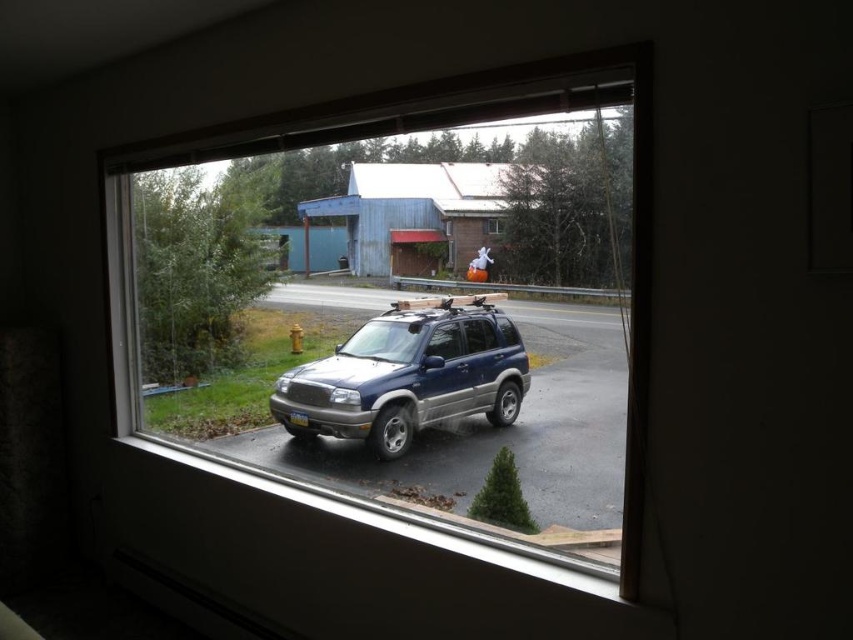
You are standing in a room with a clear glass window at center. If you want to look outside through the window, where should you position yourself relative to the window?

You should position yourself in front of the clear glass window at center to look outside through it.

You are an interior designer assessing the view from the window. The satin blue suv at center and the transparent glass window at center are both visible. Which object appears taller from your vantage point inside the room?

The satin blue suv at center appears taller than the transparent glass window at center from your vantage point inside the room because the satin blue suv at center is taller than the transparent glass window at center.